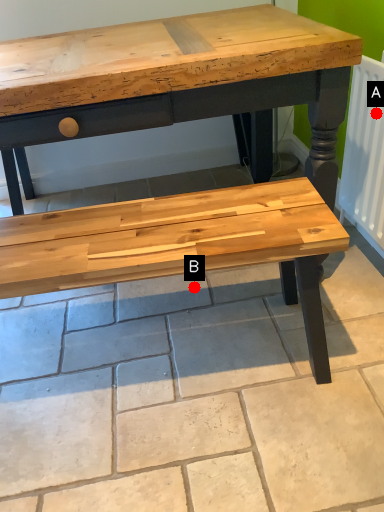
Question: Two points are circled on the image, labeled by A and B beside each circle. Which point is closer to the camera taking this photo?

Choices:
 (A) A is closer
 (B) B is closer

Answer: (A)